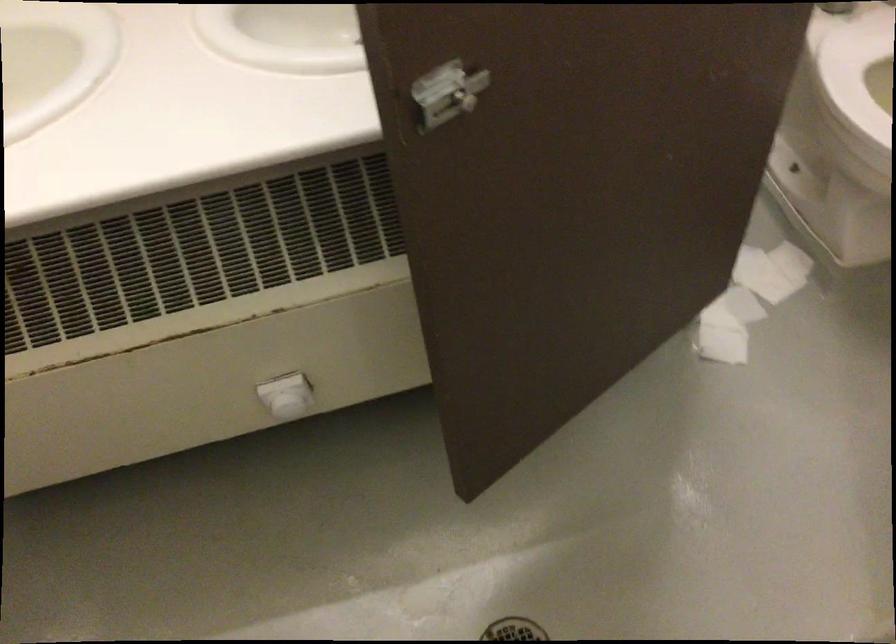
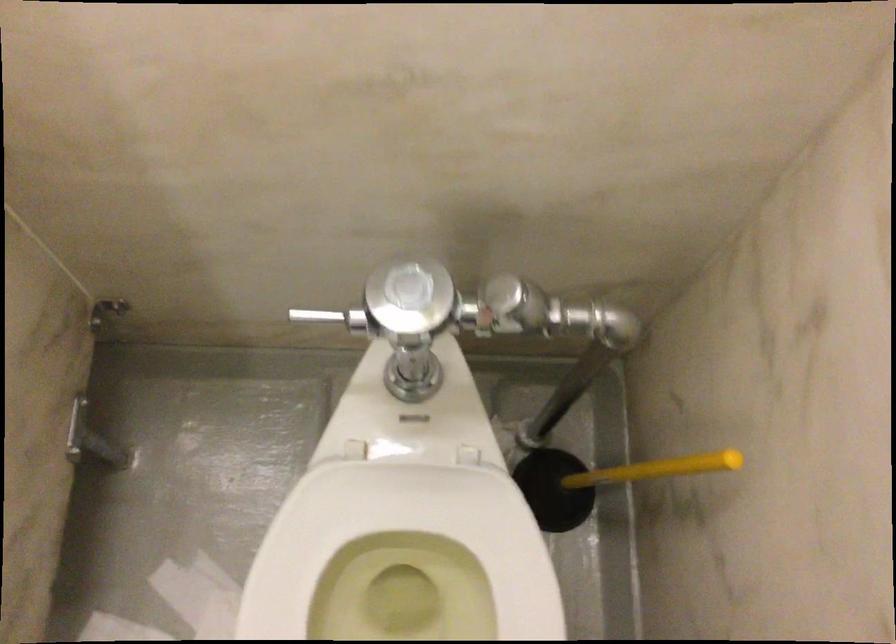
Consider the image. Which direction would the cameraman need to move to produce the second image?

The movement direction of the cameraman is right, forward.